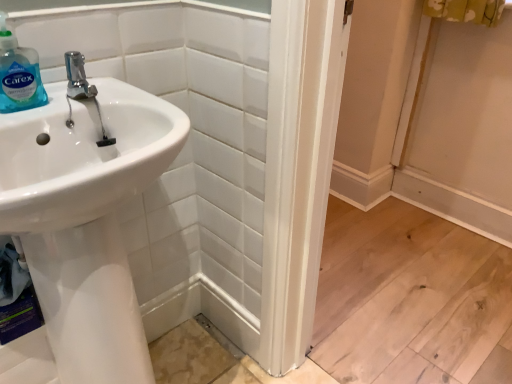
Where is `polished chrome faucet at upper left`? The width and height of the screenshot is (512, 384). polished chrome faucet at upper left is located at coordinates (78, 81).

The image size is (512, 384). Identify the location of white glossy sink at left. (85, 218).

Describe the element at coordinates (18, 74) in the screenshot. I see `translucent plastic soap dispenser at upper left` at that location.

The image size is (512, 384). I want to click on polished chrome faucet at upper left, so click(78, 81).

Is polished chrome faucet at upper left inside the boundaries of translucent plastic soap dispenser at upper left, or outside?

polished chrome faucet at upper left is spatially situated outside translucent plastic soap dispenser at upper left.

Considering the sizes of polished chrome faucet at upper left and translucent plastic soap dispenser at upper left in the image, is polished chrome faucet at upper left wider or thinner than translucent plastic soap dispenser at upper left?

In the image, polished chrome faucet at upper left appears to be wider than translucent plastic soap dispenser at upper left.

Is polished chrome faucet at upper left looking in the opposite direction of translucent plastic soap dispenser at upper left?

polished chrome faucet at upper left does not have its back to translucent plastic soap dispenser at upper left.

Looking at this image, which is closer to the camera, [79,73] or [1,105]?

Point [79,73] appears to be farther away from the viewer than point [1,105].

From a real-world perspective, is white glossy sink at left physically located above or below polished chrome faucet at upper left?

From a real-world perspective, white glossy sink at left is physically below polished chrome faucet at upper left.

From the image's perspective, is white glossy sink at left positioned above or below polished chrome faucet at upper left?

Clearly, from the image's perspective, white glossy sink at left is below polished chrome faucet at upper left.

Is white glossy sink at left situated inside polished chrome faucet at upper left or outside?

white glossy sink at left exists outside the volume of polished chrome faucet at upper left.

Based on the photo, relative to polished chrome faucet at upper left, is translucent plastic soap dispenser at upper left in front or behind?

Clearly, translucent plastic soap dispenser at upper left is in front of polished chrome faucet at upper left.

Does translucent plastic soap dispenser at upper left appear on the right side of polished chrome faucet at upper left?

In fact, translucent plastic soap dispenser at upper left is to the left of polished chrome faucet at upper left.

Looking at this image, from the image's perspective, would you say translucent plastic soap dispenser at upper left is positioned over polished chrome faucet at upper left?

Correct, translucent plastic soap dispenser at upper left appears higher than polished chrome faucet at upper left in the image.

Does polished chrome faucet at upper left turn towards white glossy sink at left?

No, polished chrome faucet at upper left does not turn towards white glossy sink at left.

Considering the positions of objects polished chrome faucet at upper left and white glossy sink at left in the image provided, who is more to the left, polished chrome faucet at upper left or white glossy sink at left?

white glossy sink at left.

Is there a large distance between polished chrome faucet at upper left and white glossy sink at left?

polished chrome faucet at upper left is near white glossy sink at left, not far away.

How many degrees apart are the facing directions of polished chrome faucet at upper left and white glossy sink at left?

They differ by 0.0544 degrees in their facing directions.

Can you tell me how much white glossy sink at left and translucent plastic soap dispenser at upper left differ in facing direction?

There is a 0.0558-degree angle between the facing directions of white glossy sink at left and translucent plastic soap dispenser at upper left.

Based on the photo, considering the positions of objects white glossy sink at left and translucent plastic soap dispenser at upper left in the image provided, who is more to the right, white glossy sink at left or translucent plastic soap dispenser at upper left?

From the viewer's perspective, white glossy sink at left appears more on the right side.

Are white glossy sink at left and translucent plastic soap dispenser at upper left beside each other?

white glossy sink at left is not next to translucent plastic soap dispenser at upper left, and they're not touching.

Can you confirm if translucent plastic soap dispenser at upper left is bigger than white glossy sink at left?

Actually, translucent plastic soap dispenser at upper left might be smaller than white glossy sink at left.

How many degrees apart are the facing directions of translucent plastic soap dispenser at upper left and white glossy sink at left?

0.0558 degrees.

Which is further, (2,61) or (110,150)?

The point (110,150) is farther.

From the image's perspective, is translucent plastic soap dispenser at upper left positioned above or below white glossy sink at left?

From the image's perspective, translucent plastic soap dispenser at upper left appears above white glossy sink at left.

At what (x,y) coordinates should I click in order to perform the action: click on plumbing fixture below the translucent plastic soap dispenser at upper left (from the image's perspective). Please return your answer as a coordinate pair (x, y). Looking at the image, I should click on (78, 81).

You are a GUI agent. You are given a task and a screenshot of the screen. Output one action in this format:
    pyautogui.click(x=<x>, y=<y>)
    Task: Click on the plumbing fixture above the white glossy sink at left (from the image's perspective)
    This screenshot has width=512, height=384.
    Given the screenshot: What is the action you would take?
    pyautogui.click(x=78, y=81)

Estimate the real-world distances between objects in this image. Which object is closer to white glossy sink at left, polished chrome faucet at upper left or translucent plastic soap dispenser at upper left?

The object closer to white glossy sink at left is polished chrome faucet at upper left.

Based on the photo, considering their positions, is polished chrome faucet at upper left positioned further to translucent plastic soap dispenser at upper left than white glossy sink at left?

white glossy sink at left is further to translucent plastic soap dispenser at upper left.

Looking at the image, which one is located further to white glossy sink at left, translucent plastic soap dispenser at upper left or polished chrome faucet at upper left?

Based on the image, translucent plastic soap dispenser at upper left appears to be further to white glossy sink at left.

Which object lies nearer to the anchor point polished chrome faucet at upper left, white glossy sink at left or translucent plastic soap dispenser at upper left?

translucent plastic soap dispenser at upper left is closer to polished chrome faucet at upper left.

Considering their positions, is white glossy sink at left positioned further to translucent plastic soap dispenser at upper left than polished chrome faucet at upper left?

Based on the image, white glossy sink at left appears to be further to translucent plastic soap dispenser at upper left.

From the image, which object appears to be nearer to polished chrome faucet at upper left, translucent plastic soap dispenser at upper left or white glossy sink at left?

translucent plastic soap dispenser at upper left.

Locate an element on the screen. The image size is (512, 384). plumbing fixture between translucent plastic soap dispenser at upper left and white glossy sink at left in the up-down direction is located at coordinates (78, 81).